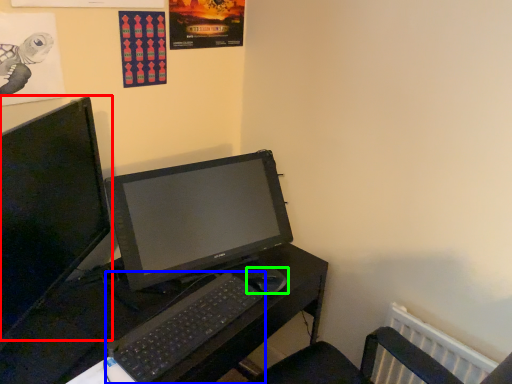
Question: Which object is the closest to the computer monitor (highlighted by a red box)? Choose among these: computer keyboard (highlighted by a blue box) or mouse (highlighted by a green box).

Choices:
 (A) computer keyboard
 (B) mouse

Answer: (A)